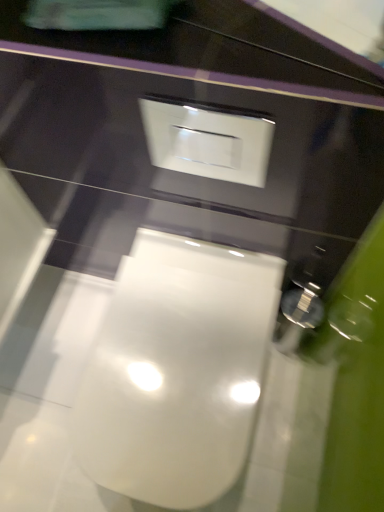
Question: Is white glossy switch at upper center wider or thinner than white glossy toilet at center?

Choices:
 (A) thin
 (B) wide

Answer: (A)

Question: In terms of size, does white glossy switch at upper center appear bigger or smaller than white glossy toilet at center?

Choices:
 (A) big
 (B) small

Answer: (B)

Question: Does point (150, 117) appear closer or farther from the camera than point (127, 300)?

Choices:
 (A) farther
 (B) closer

Answer: (A)

Question: Looking at the image, does white glossy toilet at center seem bigger or smaller compared to white glossy switch at upper center?

Choices:
 (A) small
 (B) big

Answer: (B)

Question: Considering the positions of point (198, 470) and point (264, 156), is point (198, 470) closer or farther from the camera than point (264, 156)?

Choices:
 (A) farther
 (B) closer

Answer: (A)

Question: Considering the relative positions of white glossy toilet at center and white glossy switch at upper center in the image provided, is white glossy toilet at center to the left or to the right of white glossy switch at upper center?

Choices:
 (A) left
 (B) right

Answer: (A)

Question: Relative to white glossy switch at upper center, is white glossy toilet at center in front or behind?

Choices:
 (A) behind
 (B) front

Answer: (A)